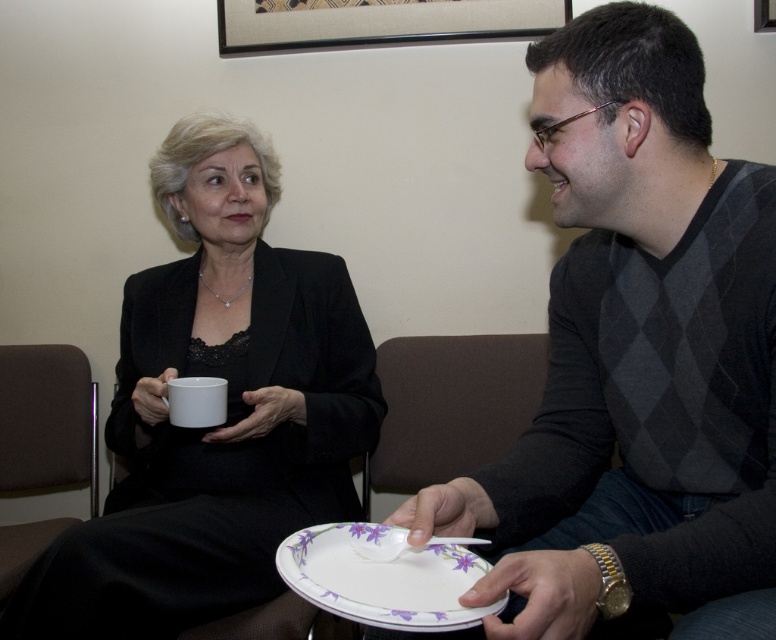
Question: Which object is the farthest from the white porcelain plate at lower center?

Choices:
 (A) matte gray sweater at center
 (B) white matte mug at center

Answer: (B)

Question: Which object appears farthest from the camera in this image?

Choices:
 (A) matte gray sweater at center
 (B) matte black suit at center

Answer: (B)

Question: Observing the image, what is the correct spatial positioning of matte gray sweater at center in reference to white matte mug at center?

Choices:
 (A) left
 (B) right

Answer: (B)

Question: Is matte black suit at center wider than white porcelain plate at lower center?

Choices:
 (A) yes
 (B) no

Answer: (A)

Question: Does matte black suit at center appear over white matte mug at center?

Choices:
 (A) yes
 (B) no

Answer: (A)

Question: Which point appears closest to the camera in this image?

Choices:
 (A) (291, 458)
 (B) (404, 595)
 (C) (757, 260)
 (D) (217, 410)

Answer: (B)